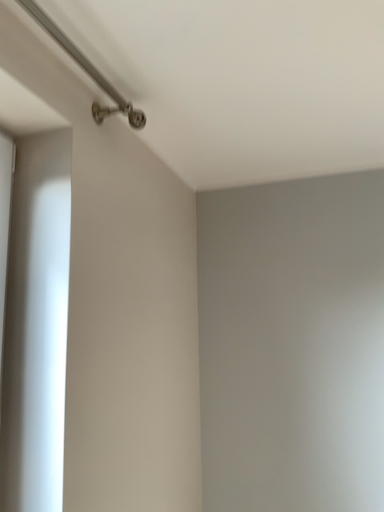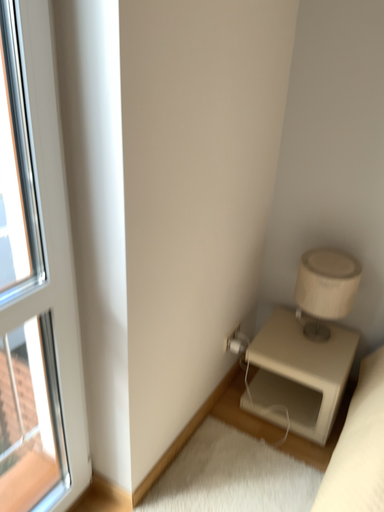
Question: Which way did the camera rotate in the video?

Choices:
 (A) rotated upward
 (B) rotated downward

Answer: (B)